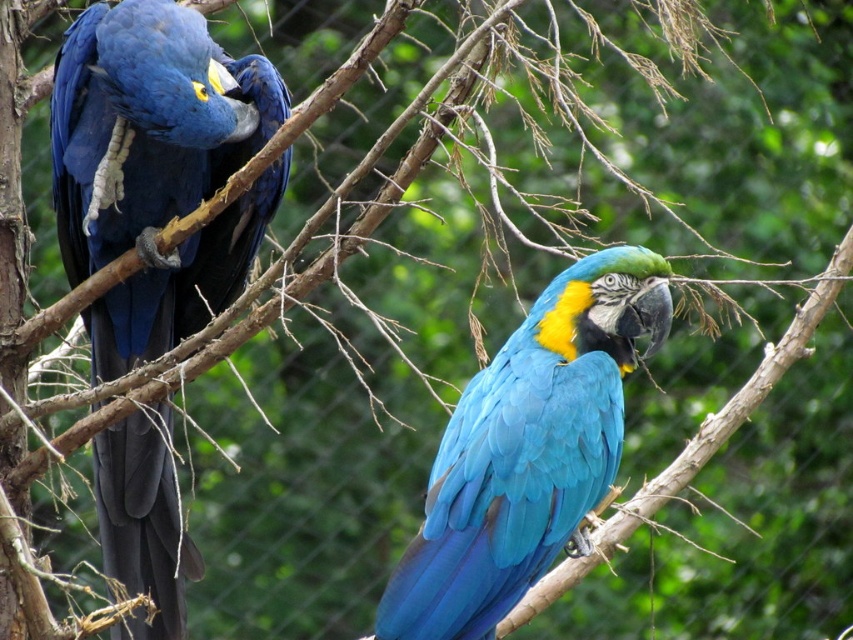
You are a birdwatcher observing two parrots in a tree. You notice the matte blue parrot at left and the blue glossy parrot at center. Which parrot has a greater width?

The matte blue parrot at left has a greater width than the blue glossy parrot at center.

From the picture: You are a birdwatcher trying to determine which point is closer to you. You see two points in the image, point [126,108] and point [585,296]. Which point is closer to you?

Point [126,108] is further to the viewer than point [585,296].

You are a birdwatcher observing two parrots in a tree. You see the matte blue parrot at left and the blue glossy parrot at center. Which parrot is positioned closer to you?

The matte blue parrot at left is closer to you because the blue glossy parrot at center is positioned behind it.